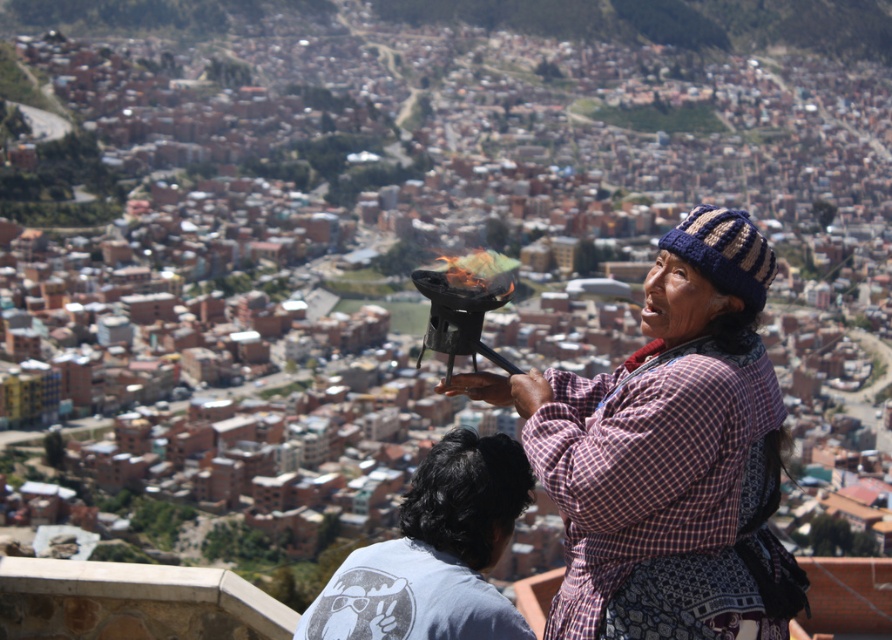
The image size is (892, 640). What do you see at coordinates (435, 552) in the screenshot? I see `gray cotton shirt at lower left` at bounding box center [435, 552].

Is gray cotton shirt at lower left above light blue cotton t-shirt at lower center?

Yes.

Is point (394, 580) in front of point (463, 563)?

That is True.

Locate an element on the screen. The height and width of the screenshot is (640, 892). gray cotton shirt at lower left is located at coordinates (435, 552).

Is the position of plaid fabric shawl at center more distant than that of light blue cotton t-shirt at lower center?

Yes, plaid fabric shawl at center is further from the viewer.

Where is `plaid fabric shawl at center`? This screenshot has height=640, width=892. plaid fabric shawl at center is located at coordinates (669, 454).

You are a GUI agent. You are given a task and a screenshot of the screen. Output one action in this format:
    pyautogui.click(x=<x>, y=<y>)
    Task: Click on the plaid fabric shawl at center
    This screenshot has height=640, width=892.
    Given the screenshot: What is the action you would take?
    pyautogui.click(x=669, y=454)

Is plaid fabric shawl at center thinner than gray cotton shirt at lower left?

No, plaid fabric shawl at center is not thinner than gray cotton shirt at lower left.

Locate an element on the screen. The width and height of the screenshot is (892, 640). plaid fabric shawl at center is located at coordinates (669, 454).